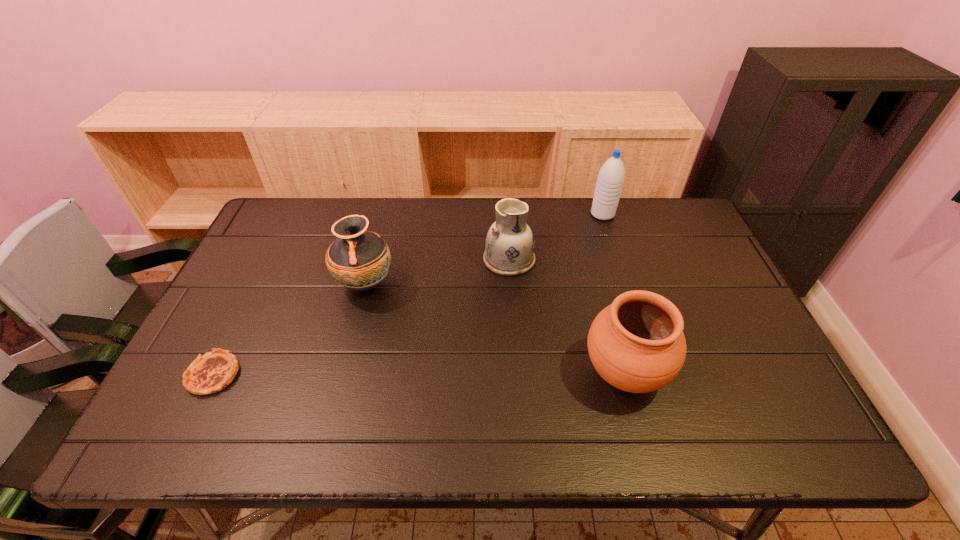
The height and width of the screenshot is (540, 960). Identify the location of free space that is in between the second pottery from right to left and the nearest pottery. (566, 316).

Select which object appears as the second closest to the quiche. Please provide its 2D coordinates. Your answer should be formatted as a tuple, i.e. [(x, y)], where the tuple contains the x and y coordinates of a point satisfying the conditions above.

[(509, 246)]

The height and width of the screenshot is (540, 960). Find the location of `object that stands as the closest to the nearest pottery`. object that stands as the closest to the nearest pottery is located at coordinates (509, 246).

In order to click on pottery that is the second closest to the rightmost pottery in this screenshot , I will do `click(358, 259)`.

Identify which pottery is the nearest to the second object from left to right. Please provide its 2D coordinates. Your answer should be formatted as a tuple, i.e. [(x, y)], where the tuple contains the x and y coordinates of a point satisfying the conditions above.

[(509, 246)]

Locate an element on the screen. The width and height of the screenshot is (960, 540). free region that satisfies the following two spatial constraints: 1. on the back side of the leftmost pottery; 2. on the right side of the leftmost object is located at coordinates (258, 284).

This screenshot has width=960, height=540. I want to click on free space that satisfies the following two spatial constraints: 1. on the back side of the leftmost pottery; 2. on the right side of the second pottery from right to left, so click(x=372, y=259).

At what (x,y) coordinates should I click in order to perform the action: click on blank area in the image that satisfies the following two spatial constraints: 1. on the back side of the water bottle; 2. on the right side of the rightmost pottery. Please return your answer as a coordinate pair (x, y). This screenshot has height=540, width=960. Looking at the image, I should click on pos(582,214).

Locate an element on the screen. This screenshot has height=540, width=960. free spot that satisfies the following two spatial constraints: 1. on the back side of the rightmost pottery; 2. on the right side of the leftmost object is located at coordinates (214, 373).